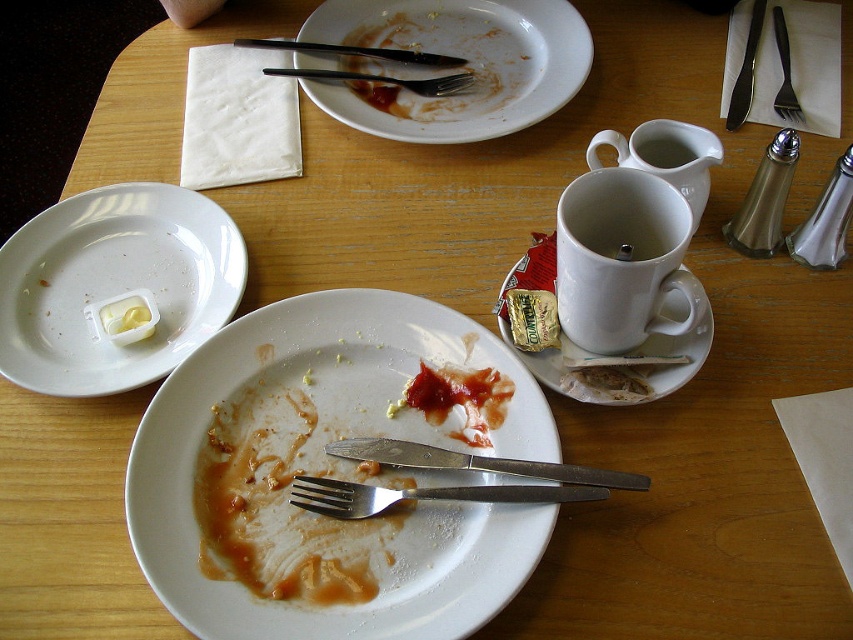
Question: Is white glossy plate at left to the left of white ceramic mug at upper center from the viewer's perspective?

Choices:
 (A) no
 (B) yes

Answer: (B)

Question: Considering the real-world distances, which object is farthest from the black metal fork at upper center?

Choices:
 (A) brushed metal fork at upper center
 (B) white ceramic mug at center
 (C) ketchup paste at center
 (D) white glossy plate at left

Answer: (C)

Question: Considering the relative positions of white ceramic saucer at upper center and white ceramic mug at upper center in the image provided, where is white ceramic saucer at upper center located with respect to white ceramic mug at upper center?

Choices:
 (A) right
 (B) left

Answer: (B)

Question: Can you confirm if white ceramic mug at upper center is thinner than white matte mug at upper center?

Choices:
 (A) yes
 (B) no

Answer: (B)

Question: Which point is farther from the camera taking this photo?

Choices:
 (A) (102, 364)
 (B) (376, 301)

Answer: (A)

Question: Which point appears closest to the camera in this image?

Choices:
 (A) (161, 428)
 (B) (471, 406)

Answer: (A)